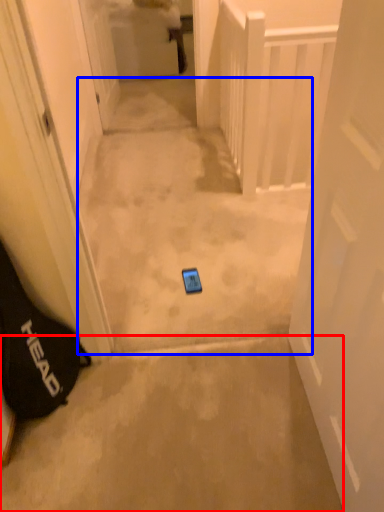
Question: Among these objects, which one is nearest to the camera, concrete (highlighted by a red box) or path (highlighted by a blue box)?

Choices:
 (A) concrete
 (B) path

Answer: (A)